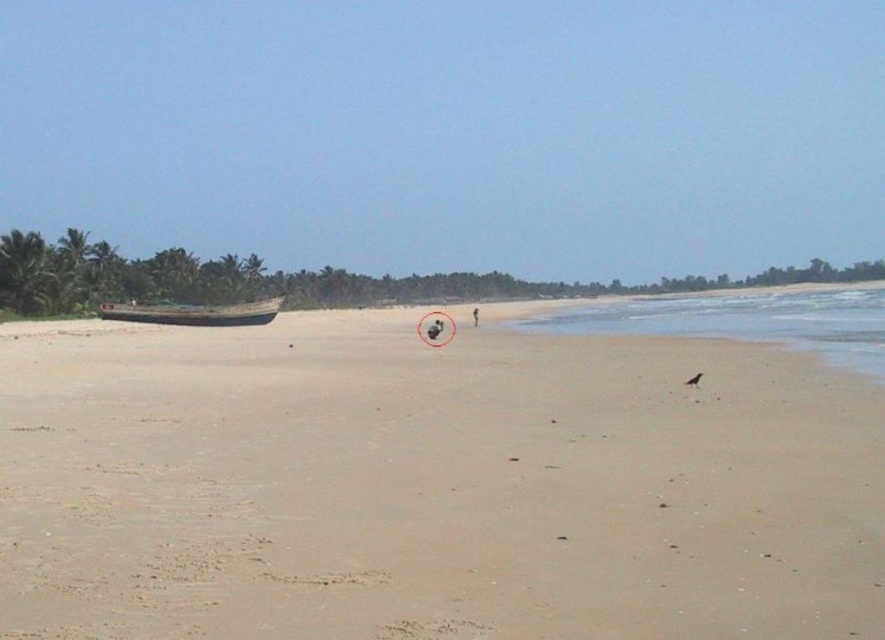
Can you confirm if smooth sand at center is taller than clear water at beach right?

No.

Is point (470, 490) farther from viewer compared to point (652, 305)?

No, (470, 490) is in front of (652, 305).

Identify the location of smooth sand at center. (432, 484).

Does smooth sand at center appear under wooden boat at left?

Yes.

Measure the distance between point (803, 552) and camera.

A distance of 6.58 meters exists between point (803, 552) and camera.

Describe the element at coordinates (432, 484) in the screenshot. I see `smooth sand at center` at that location.

Locate an element on the screen. Image resolution: width=885 pixels, height=640 pixels. smooth sand at center is located at coordinates (432, 484).

Does point (801, 296) come behind point (99, 314)?

Yes, point (801, 296) is farther from viewer.

Does clear water at beach right appear over wooden boat at left?

Correct, clear water at beach right is located above wooden boat at left.

Between point (680, 301) and point (127, 316), which one is positioned behind?

The point (680, 301) is more distant.

I want to click on clear water at beach right, so click(745, 317).